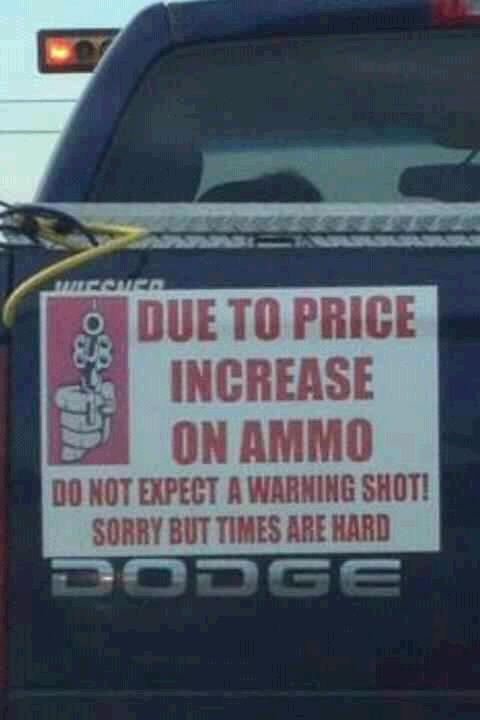
You are a GUI agent. You are given a task and a screenshot of the screen. Output one action in this format:
    pyautogui.click(x=<x>, y=<y>)
    Task: Click on the electric wires
    This screenshot has height=720, width=480.
    Given the screenshot: What is the action you would take?
    pyautogui.click(x=307, y=109), pyautogui.click(x=30, y=99), pyautogui.click(x=49, y=130)